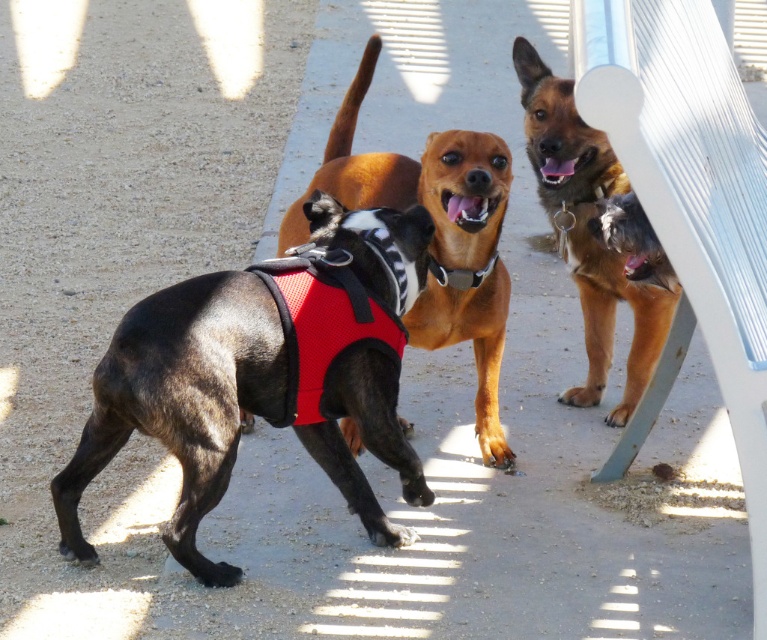
You are a photographer setting up a tripod to capture the scene. The tripod requires a space wider than the widest object between the brown fur dog at upper right and the black fabric neckband at center. Which object should you avoid placing the tripod next to?

The brown fur dog at upper right is wider than the black fabric neckband at center, so you should avoid placing the tripod next to the brown fur dog at upper right to ensure sufficient space.